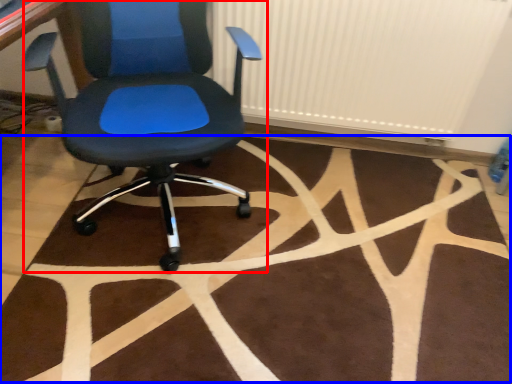
Question: Which point is further to the camera, chair (highlighted by a red box) or mat (highlighted by a blue box)?

Choices:
 (A) chair
 (B) mat

Answer: (B)